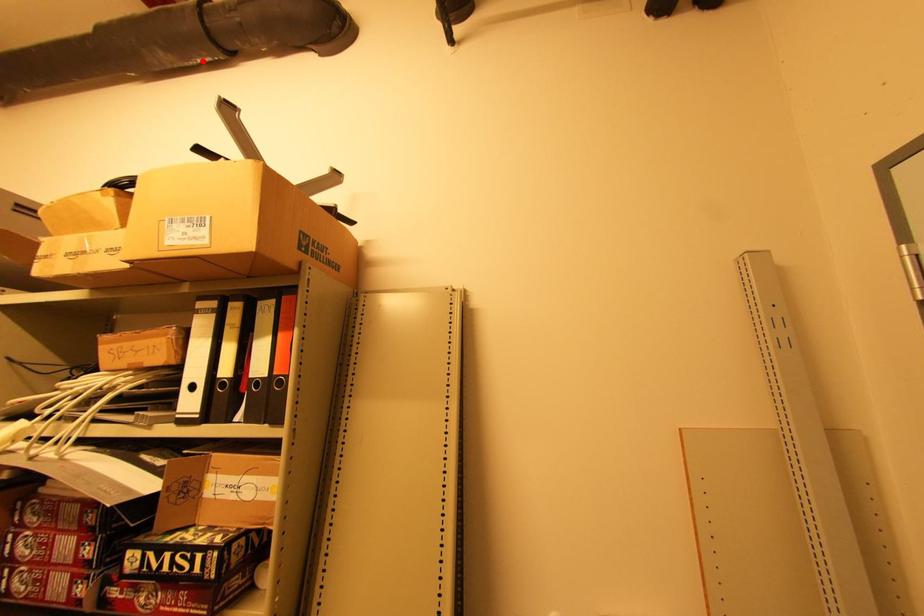
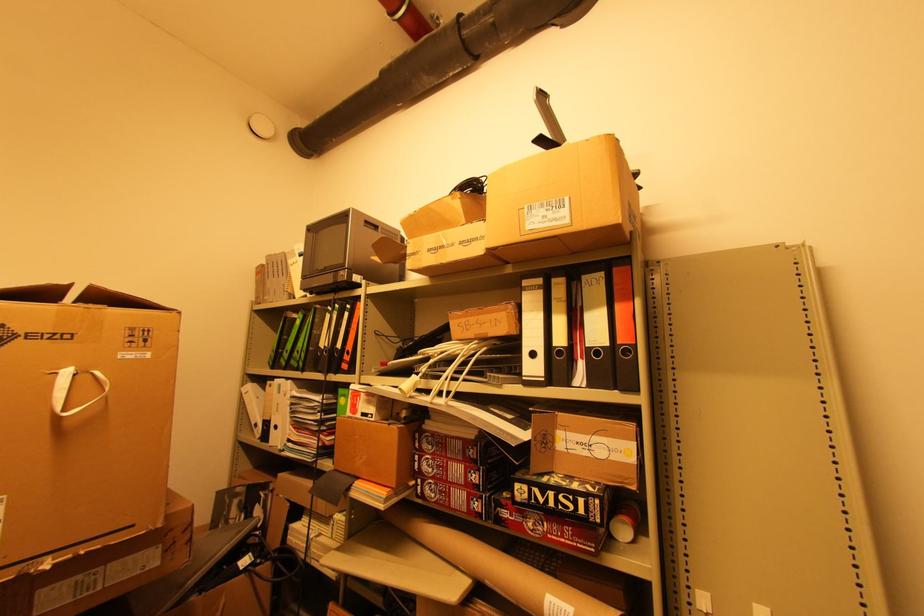
Locate, in the second image, the point that corresponds to the highlighted location in the first image.

(455, 75)